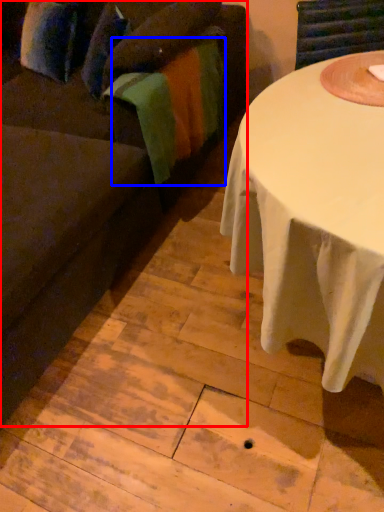
Question: Among these objects, which one is nearest to the camera, studio couch (highlighted by a red box) or blanket (highlighted by a blue box)?

Choices:
 (A) studio couch
 (B) blanket

Answer: (A)